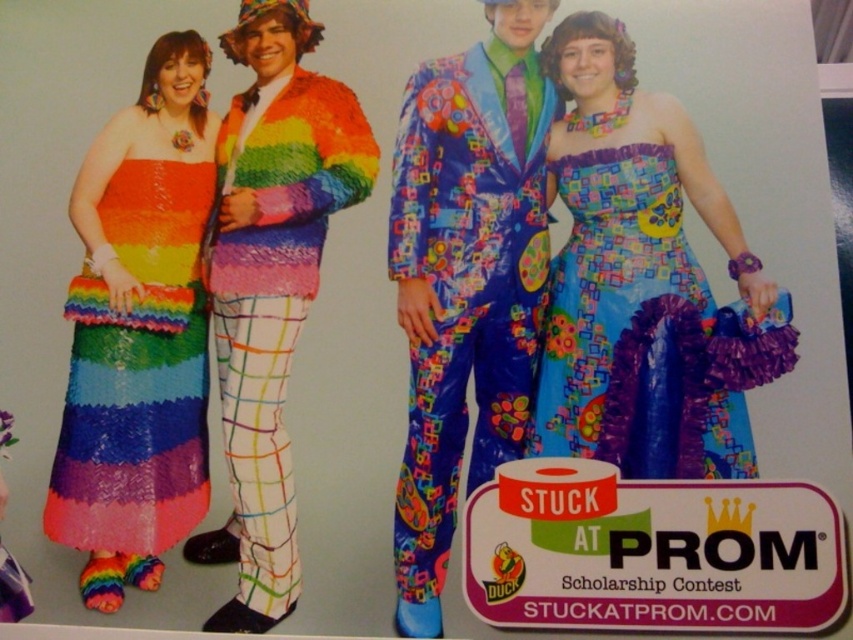
What is located at the coordinates point [466,280]?

The shiny plastic suit at center is located at point [466,280].

You are a photographer planning to take a group photo of the multicolored fabric dress at center and the rainbow sequined suit at center. To ensure both fit in the frame, you need to know which is wider. Which one has a greater width?

The multicolored fabric dress at center has a greater width than the rainbow sequined suit at center according to the description.

You are a photographer at the event and want to capture a photo where both the multicolored fabric dress at center and the rainbow sequined suit at center are visible. Based on their positions, which one should be placed on the left side of the photo?

The rainbow sequined suit at center should be placed on the left side of the photo because the multicolored fabric dress at center is to the right of it.